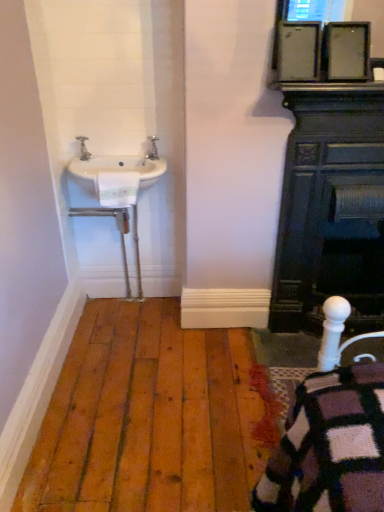
In order to click on vacant space to the left of black cast iron fireplace at right in this screenshot , I will do `click(239, 355)`.